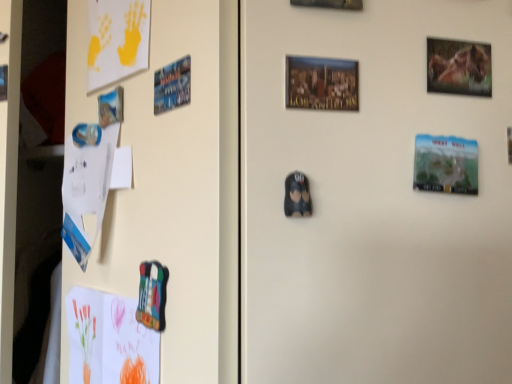
Question: Is metallic blue magnet at upper left, the 1th print viewed from the top, aimed at metallic glossy horse portrait at upper right?

Choices:
 (A) yes
 (B) no

Answer: (B)

Question: Is metallic blue magnet at upper left, placed as the 1th print when sorted from left to right, oriented away from metallic glossy horse portrait at upper right?

Choices:
 (A) no
 (B) yes

Answer: (A)

Question: Does metallic blue magnet at upper left, which ranks as the first print in back-to-front order, have a lesser height compared to metallic glossy horse portrait at upper right?

Choices:
 (A) no
 (B) yes

Answer: (B)

Question: Is the position of metallic blue magnet at upper left, the 1th print viewed from the top, more distant than that of metallic glossy horse portrait at upper right?

Choices:
 (A) yes
 (B) no

Answer: (A)

Question: Is metallic blue magnet at upper left, acting as the 3th print starting from the bottom, to the left of metallic glossy horse portrait at upper right from the viewer's perspective?

Choices:
 (A) yes
 (B) no

Answer: (A)

Question: Does metallic blue magnet at upper left, acting as the 3th print starting from the bottom, have a lesser width compared to metallic glossy horse portrait at upper right?

Choices:
 (A) yes
 (B) no

Answer: (A)

Question: Does colored paper postcard at lower left, placed as the 2th postcard when sorted from top to bottom, have a smaller size compared to yellow matte paper at upper left, which ranks as the 2th postcard in bottom-to-top order?

Choices:
 (A) yes
 (B) no

Answer: (B)

Question: Is colored paper postcard at lower left, placed as the 2th postcard when sorted from top to bottom, at the right side of yellow matte paper at upper left, acting as the 1th postcard starting from the top?

Choices:
 (A) yes
 (B) no

Answer: (B)

Question: Is the depth of colored paper postcard at lower left, which ranks as the first postcard in bottom-to-top order, less than that of yellow matte paper at upper left, which ranks as the 2th postcard in bottom-to-top order?

Choices:
 (A) yes
 (B) no

Answer: (A)

Question: From the image's perspective, is colored paper postcard at lower left, placed as the 2th postcard when sorted from top to bottom, below yellow matte paper at upper left, which ranks as the 2th postcard in bottom-to-top order?

Choices:
 (A) yes
 (B) no

Answer: (A)

Question: From a real-world perspective, is colored paper postcard at lower left, which ranks as the first postcard in bottom-to-top order, physically above yellow matte paper at upper left, acting as the 1th postcard starting from the top?

Choices:
 (A) yes
 (B) no

Answer: (B)

Question: Is colored paper postcard at lower left, which ranks as the first postcard in bottom-to-top order, bigger than yellow matte paper at upper left, which ranks as the 2th postcard in bottom-to-top order?

Choices:
 (A) yes
 (B) no

Answer: (A)

Question: Does metallic blue magnet at upper left, which ranks as the first print in back-to-front order, have a smaller size compared to black matte plush toy at center, the 3th print positioned from the back?

Choices:
 (A) no
 (B) yes

Answer: (A)